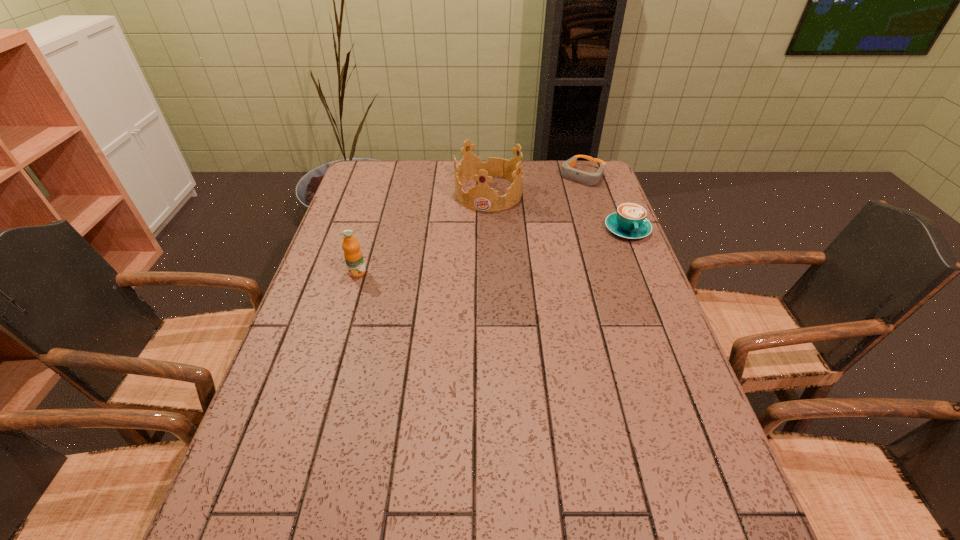
Locate an element on the screen. the nearest object is located at coordinates (353, 256).

At what (x,y) coordinates should I click in order to perform the action: click on orange juice. Please return your answer as a coordinate pair (x, y). Looking at the image, I should click on (353, 256).

Find the location of a particular element. The image size is (960, 540). the second nearest object is located at coordinates (630, 222).

At what (x,y) coordinates should I click in order to perform the action: click on the second shortest object. Please return your answer as a coordinate pair (x, y). Looking at the image, I should click on (630, 222).

At what (x,y) coordinates should I click in order to perform the action: click on goggles. Please return your answer as a coordinate pair (x, y). Looking at the image, I should click on (589, 179).

This screenshot has height=540, width=960. I want to click on tiara, so click(x=481, y=197).

Where is `vacant region located 0.140m on the label of the nearest object`? vacant region located 0.140m on the label of the nearest object is located at coordinates (345, 316).

I want to click on free spot located with the handle on the right side of the cappuccino, so pyautogui.click(x=660, y=309).

Identify the location of free region located on the front and back of the goggles. (556, 205).

This screenshot has width=960, height=540. I want to click on vacant region located on the front and back of the goggles, so click(x=535, y=228).